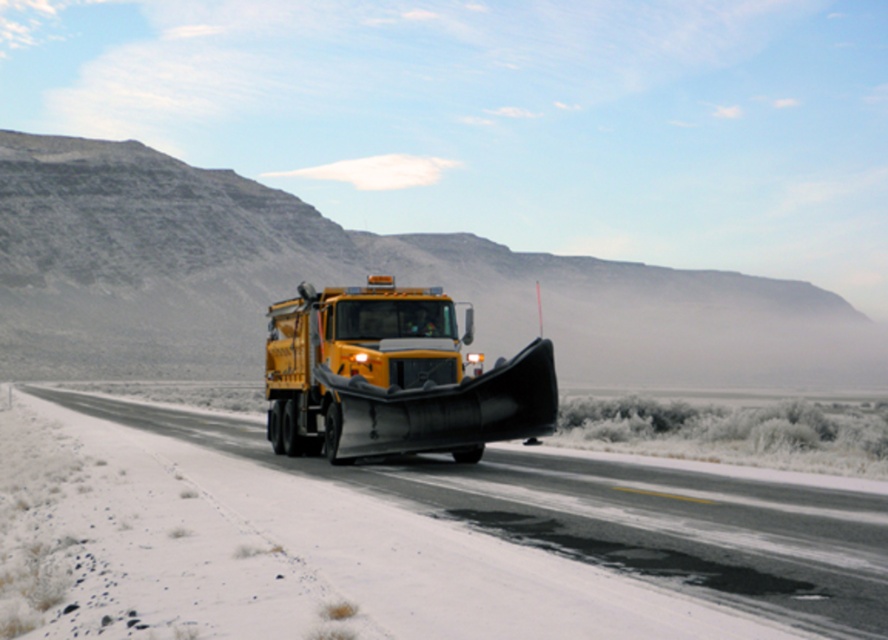
Question: Does black asphalt highway at center appear on the right side of yellow matte/solid truck at center?

Choices:
 (A) yes
 (B) no

Answer: (B)

Question: Can you confirm if black asphalt highway at center is positioned below yellow matte/solid truck at center?

Choices:
 (A) no
 (B) yes

Answer: (B)

Question: Which point appears farthest from the camera in this image?

Choices:
 (A) (120, 404)
 (B) (414, 442)

Answer: (A)

Question: Which object is closer to the camera taking this photo?

Choices:
 (A) yellow matte/solid truck at center
 (B) black asphalt highway at center

Answer: (B)

Question: Which point is closer to the camera?

Choices:
 (A) (538, 624)
 (B) (382, 424)

Answer: (A)

Question: Is black asphalt highway at center further to the viewer compared to yellow matte/solid truck at center?

Choices:
 (A) yes
 (B) no

Answer: (B)